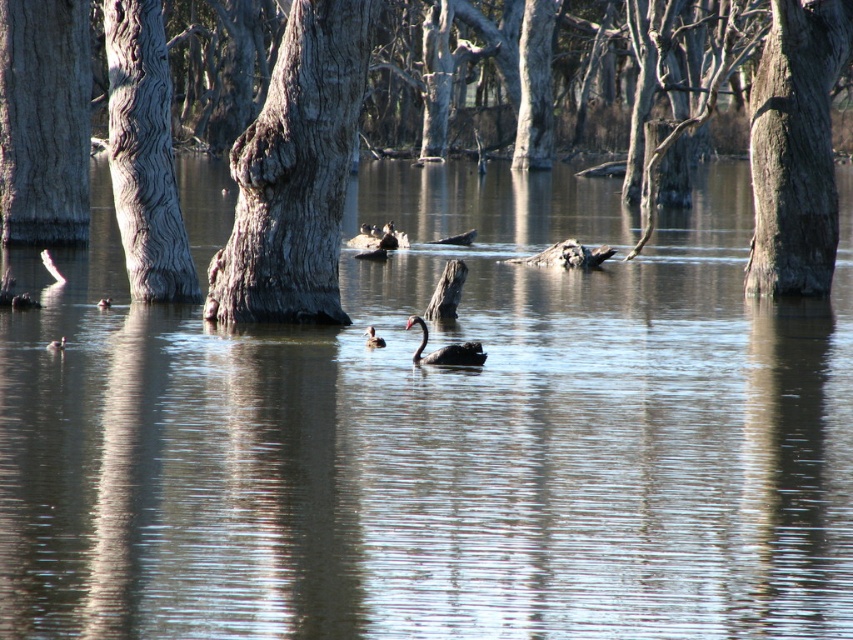
Is gray textured tree trunk at center above brown matte duck at lower left?

Yes.

Is point (341, 308) positioned before point (64, 348)?

That is False.

Which is behind, point (338, 314) or point (49, 342)?

The point (338, 314) is behind.

Identify the location of gray textured tree trunk at center. (294, 173).

Between brown matte duck at center and brown matte duck at lower left, which one appears on the right side from the viewer's perspective?

Positioned to the right is brown matte duck at center.

Does brown matte duck at center come behind brown matte duck at lower left?

Yes.

Image resolution: width=853 pixels, height=640 pixels. Find the location of `brown matte duck at center`. brown matte duck at center is located at coordinates (372, 337).

Is brown wood tree at center to the left of brown matte duck at lower left from the viewer's perspective?

In fact, brown wood tree at center is to the right of brown matte duck at lower left.

The width and height of the screenshot is (853, 640). I want to click on brown wood tree at center, so click(297, 170).